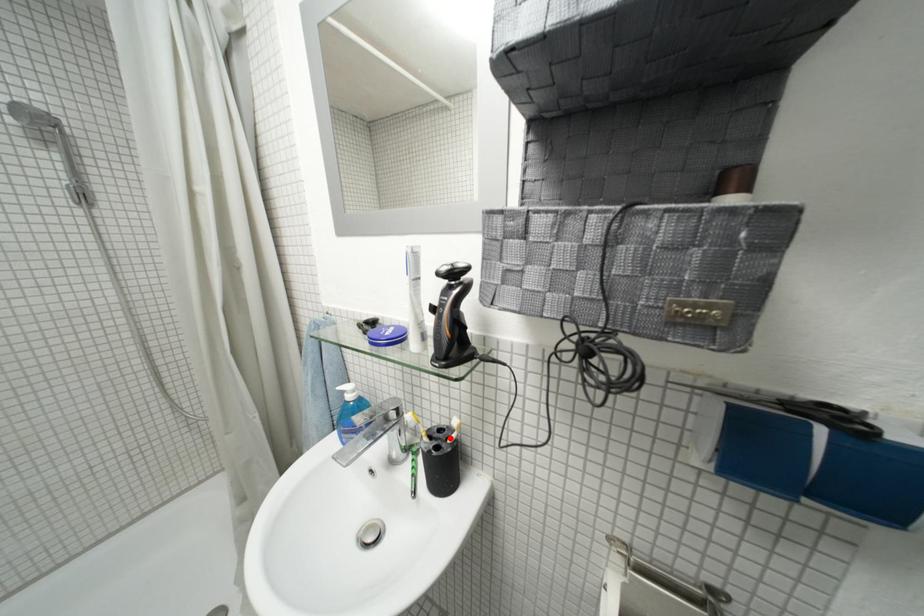
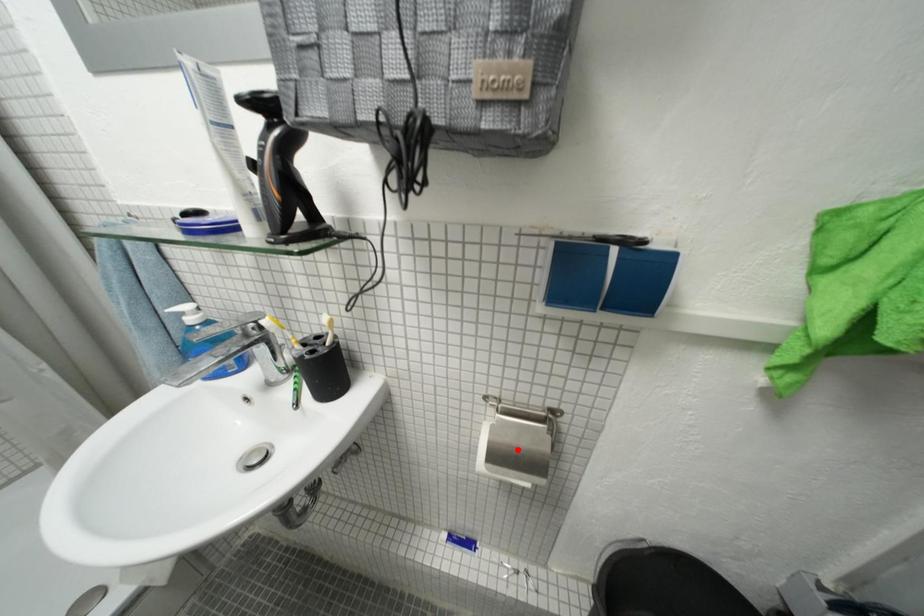
I am providing you with two images of the same scene from different viewpoints. A red point is marked on the first image and another point is marked on the second image. Is the red point in image1 aligned with the point shown in image2?

No